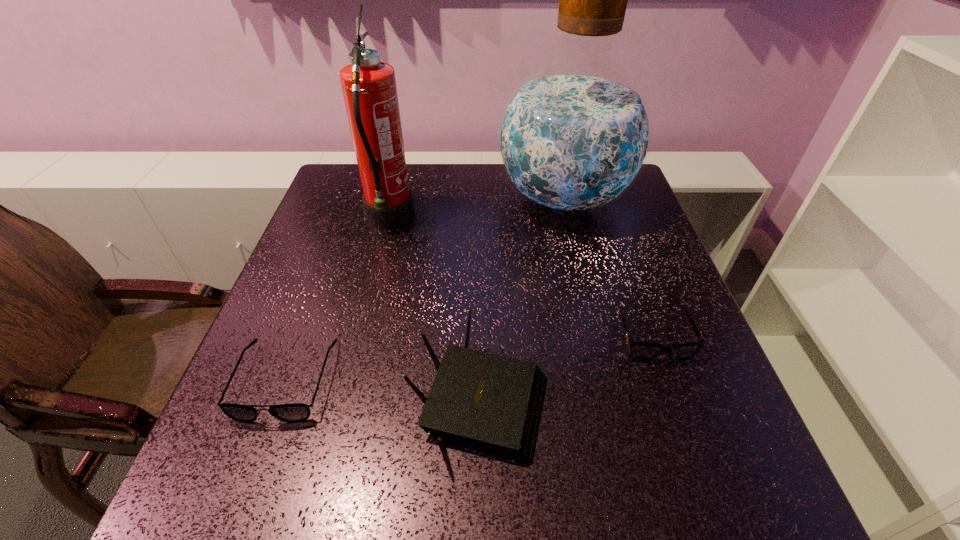
This screenshot has height=540, width=960. What are the coordinates of `vacant space that satisfies the following two spatial constraints: 1. on the front-facing side of the third tallest object; 2. on the left side of the fire extinguisher` in the screenshot? It's located at (347, 396).

Where is `free location that satisfies the following two spatial constraints: 1. on the front side of the water jug; 2. on the front-facing side of the fire extinguisher`? Image resolution: width=960 pixels, height=540 pixels. free location that satisfies the following two spatial constraints: 1. on the front side of the water jug; 2. on the front-facing side of the fire extinguisher is located at coordinates (568, 221).